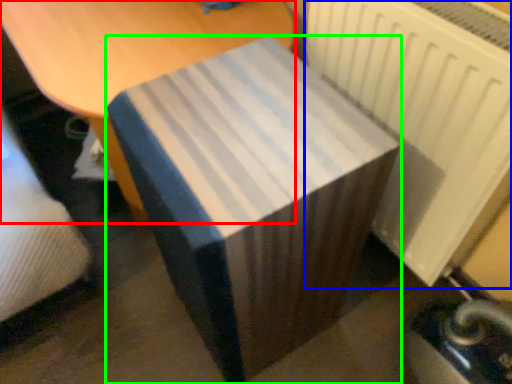
Question: Which is nearer to the furniture (highlighted by a red box)? radiator (highlighted by a blue box) or table (highlighted by a green box).

Choices:
 (A) radiator
 (B) table

Answer: (B)